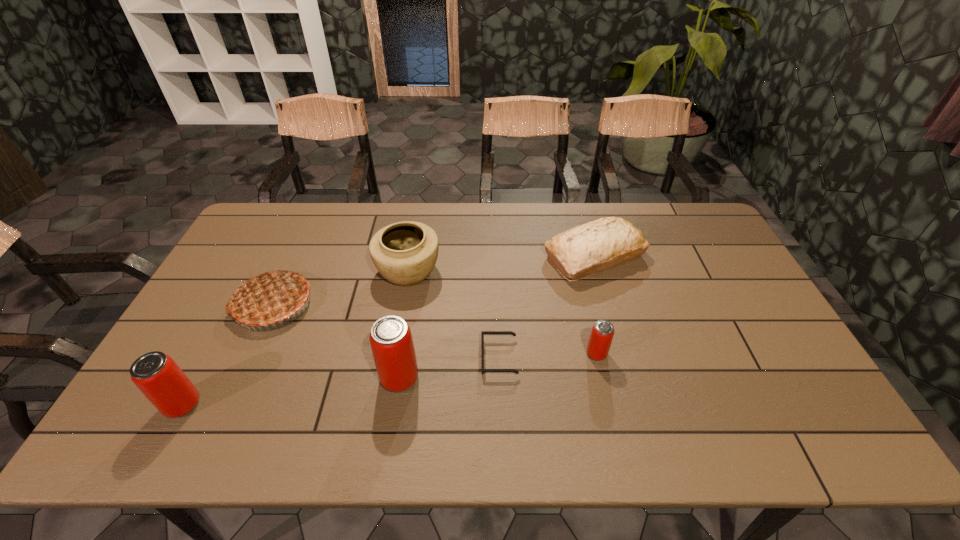
Identify the location of pie located in the left edge section of the desktop. The width and height of the screenshot is (960, 540). (268, 298).

Locate an element on the screen. This screenshot has height=540, width=960. object that is at the near left corner is located at coordinates (157, 376).

In order to click on vacant space at the far edge of the desktop in this screenshot , I will do `click(472, 239)`.

The image size is (960, 540). Find the location of `vacant space at the near edge of the desktop`. vacant space at the near edge of the desktop is located at coordinates (665, 378).

Where is `free space at the right edge`? free space at the right edge is located at coordinates (709, 255).

Locate an element on the screen. vacant space at the near right corner of the desktop is located at coordinates (783, 394).

Identify the location of free space between the shortest beer can and the bread. (595, 305).

I want to click on vacant area that lies between the pottery and the leftmost beer can, so click(x=295, y=338).

Find the location of `free space between the shortest beer can and the pottery`. free space between the shortest beer can and the pottery is located at coordinates (502, 312).

Identify the location of free space between the shortest object and the shortest beer can. [548, 355].